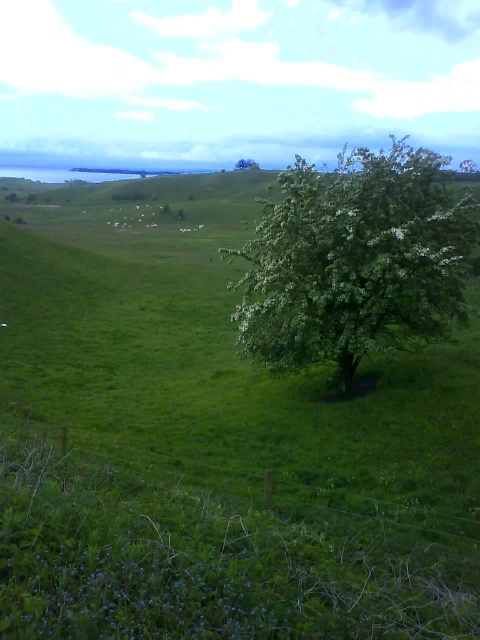
You are standing at the origin point in the image. Which direction should you move to reach the green leafy tree at center?

The green leafy tree at center is located at coordinates 0.408 on the x and 0.740 on the y axis. Since you are at the origin, you should move northeast to reach it.

You are standing in the rural landscape and want to walk towards the green leafy tree at center and the green leafy tree at upper center. Which tree should you head towards if you want to reach the one that is closer to you first?

You should head towards the green leafy tree at center first because it is closer to you than the green leafy tree at upper center.